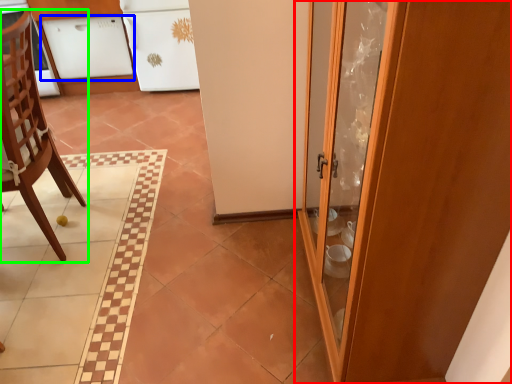
Question: Which object is the closest to the door (highlighted by a red box)? Choose among these: cabinetry (highlighted by a blue box) or chair (highlighted by a green box).

Choices:
 (A) cabinetry
 (B) chair

Answer: (B)